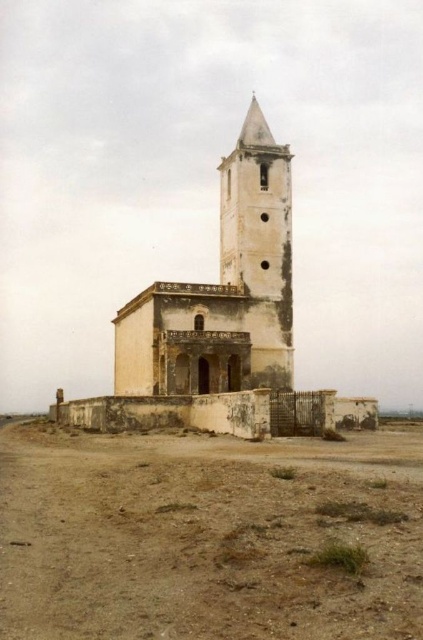
You are standing at the edge of the brown sandy dirt field at lower left and want to walk towards the white weathered church at center. Which direction should you head to reach the church?

Since the brown sandy dirt field at lower left has a lesser width compared to the white weathered church at center, you should head towards the center direction to reach the church.

You are a landscape architect planning to install a new pathway from the brown sandy dirt field at lower left to the smooth beige stone bell tower at center. Considering their widths, which area will require more material for the pathway base?

The brown sandy dirt field at lower left requires more material for the pathway base since its width surpasses that of the smooth beige stone bell tower at center, as stated in the description.